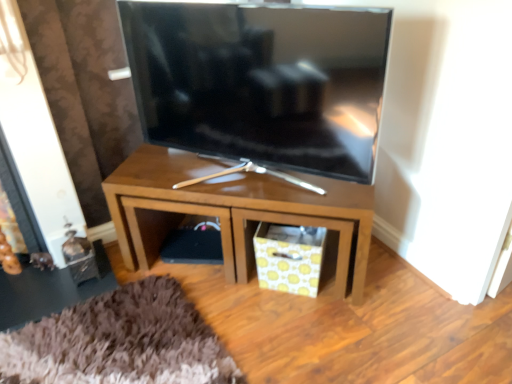
Find the location of a particular element. Image resolution: width=512 pixels, height=384 pixels. free location to the right of yellow patterned paper at lower center is located at coordinates (344, 290).